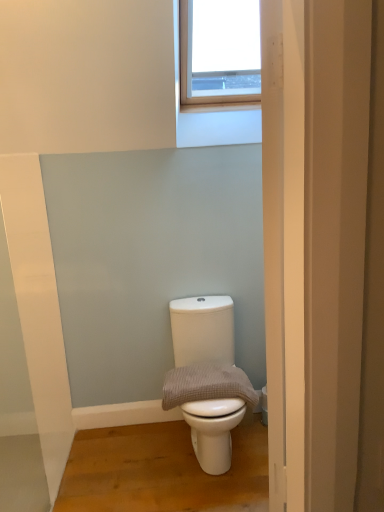
Find the location of a particular element. The height and width of the screenshot is (512, 384). waffle-textured towel at center is located at coordinates (206, 385).

Describe the element at coordinates (206, 385) in the screenshot. The width and height of the screenshot is (384, 512). I see `waffle-textured towel at center` at that location.

Image resolution: width=384 pixels, height=512 pixels. What do you see at coordinates (207, 377) in the screenshot? I see `white matte toilet at center` at bounding box center [207, 377].

Identify the location of white matte toilet at center. (207, 377).

Where is `waffle-textured towel at center`? The width and height of the screenshot is (384, 512). waffle-textured towel at center is located at coordinates (206, 385).

Consider the image. Considering the relative positions of waffle-textured towel at center and white matte toilet at center in the image provided, is waffle-textured towel at center to the right of white matte toilet at center from the viewer's perspective?

Incorrect, waffle-textured towel at center is not on the right side of white matte toilet at center.

Which is in front, waffle-textured towel at center or white matte toilet at center?

Positioned in front is white matte toilet at center.

Is point (205, 375) farther from viewer compared to point (229, 419)?

Yes.

From the image's perspective, is waffle-textured towel at center above white matte toilet at center?

Yes, from the image's perspective, waffle-textured towel at center is over white matte toilet at center.

From a real-world perspective, which object rests below the other?

In real-world perspective, white matte toilet at center is lower.

Considering the relative sizes of waffle-textured towel at center and white matte toilet at center in the image provided, is waffle-textured towel at center wider than white matte toilet at center?

No, waffle-textured towel at center is not wider than white matte toilet at center.

From the picture: Considering the relative sizes of waffle-textured towel at center and white matte toilet at center in the image provided, is waffle-textured towel at center taller than white matte toilet at center?

No, waffle-textured towel at center is not taller than white matte toilet at center.

Is waffle-textured towel at center bigger than white matte toilet at center?

No, waffle-textured towel at center is not bigger than white matte toilet at center.

Is waffle-textured towel at center inside the boundaries of white matte toilet at center, or outside?

waffle-textured towel at center is enclosed within white matte toilet at center.

Based on the photo, is waffle-textured towel at center far from white matte toilet at center?

That's not correct — waffle-textured towel at center is a little close to white matte toilet at center.

Is waffle-textured towel at center oriented away from white matte toilet at center?

Yes, waffle-textured towel at center is positioned with its back facing white matte toilet at center.

Measure the distance between waffle-textured towel at center and white matte toilet at center.

waffle-textured towel at center and white matte toilet at center are 9.45 centimeters apart.

Locate an element on the screen. The height and width of the screenshot is (512, 384). toilet in front of the waffle-textured towel at center is located at coordinates (207, 377).

Which object is positioned more to the right, white matte toilet at center or waffle-textured towel at center?

From the viewer's perspective, white matte toilet at center appears more on the right side.

Between white matte toilet at center and waffle-textured towel at center, which one is positioned behind?

waffle-textured towel at center is behind.

Does point (192, 384) come farther from viewer compared to point (205, 395)?

Yes, it is.

From the image's perspective, is white matte toilet at center under waffle-textured towel at center?

Yes, from the image's perspective, white matte toilet at center is beneath waffle-textured towel at center.

From a real-world perspective, which object stands above the other?

In real-world perspective, waffle-textured towel at center is above.

Can you confirm if white matte toilet at center is wider than waffle-textured towel at center?

Correct, the width of white matte toilet at center exceeds that of waffle-textured towel at center.

Between white matte toilet at center and waffle-textured towel at center, which one has more height?

Standing taller between the two is white matte toilet at center.

In the scene shown: Which of these two, white matte toilet at center or waffle-textured towel at center, is smaller?

With smaller size is waffle-textured towel at center.

Is white matte toilet at center located outside waffle-textured towel at center?

Yes, white matte toilet at center is not within waffle-textured towel at center.

Is white matte toilet at center with waffle-textured towel at center?

Yes, the surface of white matte toilet at center is in contact with waffle-textured towel at center.

Is white matte toilet at center aimed at waffle-textured towel at center?

Yes.

The image size is (384, 512). I want to click on toilet in front of the waffle-textured towel at center, so click(207, 377).

The width and height of the screenshot is (384, 512). What are the coordinates of `toilet on the right of waffle-textured towel at center` in the screenshot? It's located at (207, 377).

At what (x,y) coordinates should I click in order to perform the action: click on toilet below the waffle-textured towel at center (from the image's perspective). Please return your answer as a coordinate pair (x, y). This screenshot has width=384, height=512. Looking at the image, I should click on (207, 377).